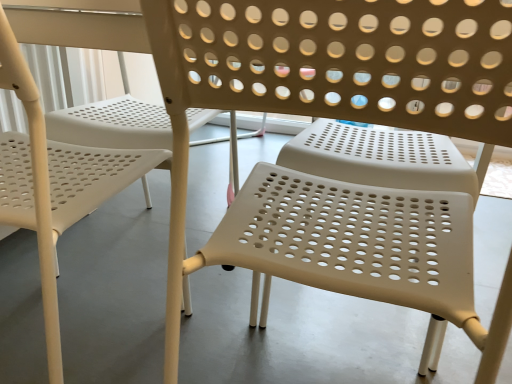
This screenshot has width=512, height=384. What do you see at coordinates (333, 116) in the screenshot?
I see `beige plastic chair at center, the first chair viewed from the right` at bounding box center [333, 116].

This screenshot has height=384, width=512. I want to click on beige plastic chair at center, the first chair viewed from the right, so click(x=333, y=116).

The height and width of the screenshot is (384, 512). What do you see at coordinates (35, 184) in the screenshot?
I see `white plastic chair at center, placed as the 1th chair when sorted from left to right` at bounding box center [35, 184].

You are a GUI agent. You are given a task and a screenshot of the screen. Output one action in this format:
    pyautogui.click(x=<x>, y=<y>)
    Task: Click on the white plastic chair at center, the second chair viewed from the right
    
    Given the screenshot: What is the action you would take?
    pyautogui.click(x=35, y=184)

Image resolution: width=512 pixels, height=384 pixels. Identify the location of beige plastic chair at center, the first chair viewed from the right. (333, 116).

Visually, is beige plastic chair at center, the first chair viewed from the right, positioned to the left or to the right of white plastic chair at center, the second chair viewed from the right?

Clearly, beige plastic chair at center, the first chair viewed from the right, is on the right of white plastic chair at center, the second chair viewed from the right, in the image.

Which object is closer to the camera, beige plastic chair at center, the 2th chair positioned from the left, or white plastic chair at center, the second chair viewed from the right?

beige plastic chair at center, the 2th chair positioned from the left, is more forward.

Is point (317, 241) closer or farther from the camera than point (53, 313)?

Clearly, point (317, 241) is more distant from the camera than point (53, 313).

From the image's perspective, is beige plastic chair at center, the 2th chair positioned from the left, on top of white plastic chair at center, the second chair viewed from the right?

No, from the image's perspective, beige plastic chair at center, the 2th chair positioned from the left, is not over white plastic chair at center, the second chair viewed from the right.

From a real-world perspective, is beige plastic chair at center, the 2th chair positioned from the left, physically located above or below white plastic chair at center, the second chair viewed from the right?

Clearly, from a real-world perspective, beige plastic chair at center, the 2th chair positioned from the left, is above white plastic chair at center, the second chair viewed from the right.

Which object is thinner, beige plastic chair at center, the 2th chair positioned from the left, or white plastic chair at center, placed as the 1th chair when sorted from left to right?

beige plastic chair at center, the 2th chair positioned from the left, is thinner.

Considering the relative sizes of beige plastic chair at center, the 2th chair positioned from the left, and white plastic chair at center, the second chair viewed from the right, in the image provided, is beige plastic chair at center, the 2th chair positioned from the left, shorter than white plastic chair at center, the second chair viewed from the right,?

Incorrect, the height of beige plastic chair at center, the 2th chair positioned from the left, does not fall short of that of white plastic chair at center, the second chair viewed from the right.

Between beige plastic chair at center, the 2th chair positioned from the left, and white plastic chair at center, placed as the 1th chair when sorted from left to right, which one has smaller size?

beige plastic chair at center, the 2th chair positioned from the left, is smaller.

Is beige plastic chair at center, the first chair viewed from the right, not inside white plastic chair at center, placed as the 1th chair when sorted from left to right?

Yes, beige plastic chair at center, the first chair viewed from the right, is located beyond the bounds of white plastic chair at center, placed as the 1th chair when sorted from left to right.

Is there a large distance between beige plastic chair at center, the first chair viewed from the right, and white plastic chair at center, placed as the 1th chair when sorted from left to right?

No, beige plastic chair at center, the first chair viewed from the right, is not far away from white plastic chair at center, placed as the 1th chair when sorted from left to right.

Is beige plastic chair at center, the 2th chair positioned from the left, positioned with its back to white plastic chair at center, the second chair viewed from the right?

No, beige plastic chair at center, the 2th chair positioned from the left,'s orientation is not away from white plastic chair at center, the second chair viewed from the right.

Consider the image. How different are the orientations of beige plastic chair at center, the 2th chair positioned from the left, and white plastic chair at center, the second chair viewed from the right, in degrees?

beige plastic chair at center, the 2th chair positioned from the left, and white plastic chair at center, the second chair viewed from the right, are facing 0.000258 degrees away from each other.

The width and height of the screenshot is (512, 384). In order to click on chair on the right of white plastic chair at center, placed as the 1th chair when sorted from left to right in this screenshot , I will do `click(333, 116)`.

Between white plastic chair at center, placed as the 1th chair when sorted from left to right, and beige plastic chair at center, the first chair viewed from the right, which one appears on the left side from the viewer's perspective?

white plastic chair at center, placed as the 1th chair when sorted from left to right, is more to the left.

Between white plastic chair at center, the second chair viewed from the right, and beige plastic chair at center, the 2th chair positioned from the left, which one is positioned behind?

white plastic chair at center, the second chair viewed from the right, is more distant.

Is point (177, 355) closer or farther from the camera than point (373, 116)?

Point (177, 355) is farther from the camera than point (373, 116).

From the image's perspective, which one is positioned lower, white plastic chair at center, the second chair viewed from the right, or beige plastic chair at center, the 2th chair positioned from the left?

beige plastic chair at center, the 2th chair positioned from the left, from the image's perspective.

From a real-world perspective, is white plastic chair at center, placed as the 1th chair when sorted from left to right, physically above beige plastic chair at center, the 2th chair positioned from the left?

Incorrect, from a real-world perspective, white plastic chair at center, placed as the 1th chair when sorted from left to right, is lower than beige plastic chair at center, the 2th chair positioned from the left.

Between white plastic chair at center, placed as the 1th chair when sorted from left to right, and beige plastic chair at center, the 2th chair positioned from the left, which one has smaller width?

beige plastic chair at center, the 2th chair positioned from the left, is thinner.

Between white plastic chair at center, the second chair viewed from the right, and beige plastic chair at center, the 2th chair positioned from the left, which one has less height?

white plastic chair at center, the second chair viewed from the right, is shorter.

Based on the photo, considering the sizes of objects white plastic chair at center, the second chair viewed from the right, and beige plastic chair at center, the first chair viewed from the right, in the image provided, who is smaller, white plastic chair at center, the second chair viewed from the right, or beige plastic chair at center, the first chair viewed from the right,?

Smaller between the two is beige plastic chair at center, the first chair viewed from the right.

Is white plastic chair at center, the second chair viewed from the right, situated inside beige plastic chair at center, the first chair viewed from the right, or outside?

white plastic chair at center, the second chair viewed from the right, exists outside the volume of beige plastic chair at center, the first chair viewed from the right.

Is white plastic chair at center, the second chair viewed from the right, next to beige plastic chair at center, the first chair viewed from the right, and touching it?

No, white plastic chair at center, the second chair viewed from the right, is not making contact with beige plastic chair at center, the first chair viewed from the right.

Could you tell me if white plastic chair at center, the second chair viewed from the right, is turned towards beige plastic chair at center, the first chair viewed from the right?

No, white plastic chair at center, the second chair viewed from the right, does not turn towards beige plastic chair at center, the first chair viewed from the right.

Measure the distance from white plastic chair at center, placed as the 1th chair when sorted from left to right, to beige plastic chair at center, the 2th chair positioned from the left.

white plastic chair at center, placed as the 1th chair when sorted from left to right, is 18.28 centimeters from beige plastic chair at center, the 2th chair positioned from the left.

I want to click on chair located below the white plastic chair at center, placed as the 1th chair when sorted from left to right (from the image's perspective), so click(333, 116).

Where is `chair behind the beige plastic chair at center, the first chair viewed from the right`? The width and height of the screenshot is (512, 384). chair behind the beige plastic chair at center, the first chair viewed from the right is located at coordinates (35, 184).

Identify the location of chair below the beige plastic chair at center, the 2th chair positioned from the left (from a real-world perspective). This screenshot has height=384, width=512. (35, 184).